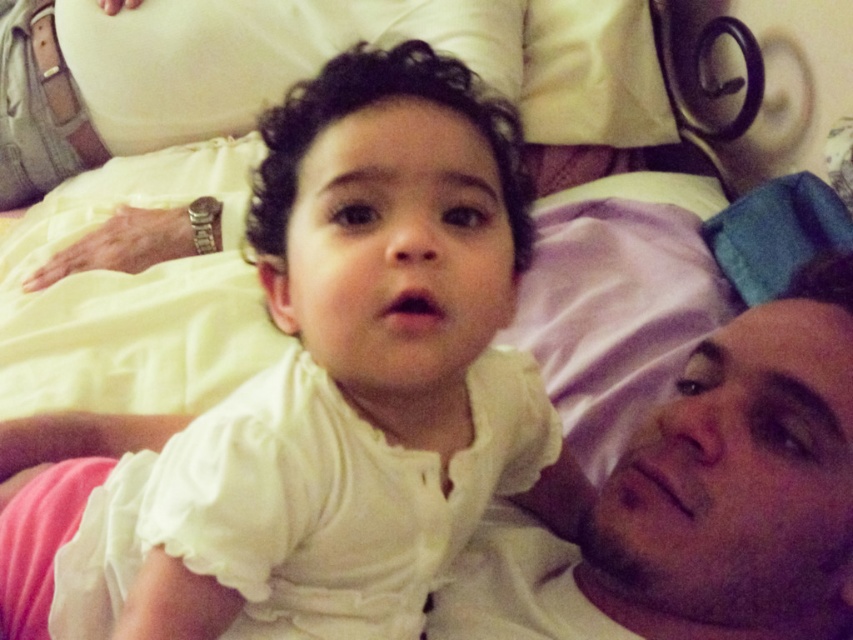
You are taking a photo with a camera. The camera is positioned at a certain distance from the point marked as point (426, 51). If you want to ensure that the entire scene including the child and the adult is in focus, what should you do with the camera?

The point marked as point (426, 51) is 49.25 centimeters away from the camera. To ensure the entire scene including the child and the adult is in focus, adjust the camera focus so that it is set to a distance that covers both the foreground and background elements, considering the depth of field required for all subjects to be clear.

Based on the scene description, can you determine if the white soft fabric at center is wider than the smooth skin face at center?

The white soft fabric at center is wider than the smooth skin face at center according to the description.

You are a photographer trying to capture a closeup shot of the child. You need to position your camera so that the white soft fabric at center and the smooth skin face at center are both in focus. Which object should you focus on first to ensure both are sharp?

Result: The white soft fabric at center is to the left of smooth skin face at center. Since the fabric is closer to the camera, focusing on it first will help ensure both objects are in focus as the face is further away.